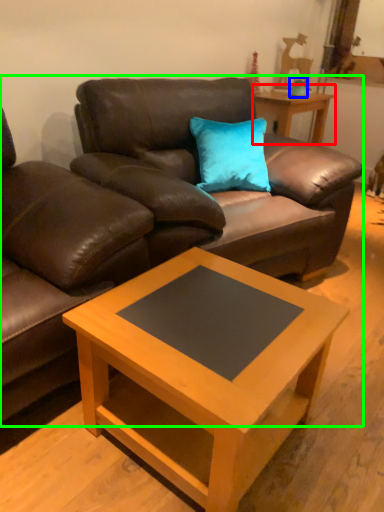
Question: Which is nearer to the table (highlighted by a red box)? teal (highlighted by a blue box) or studio couch (highlighted by a green box).

Choices:
 (A) teal
 (B) studio couch

Answer: (A)